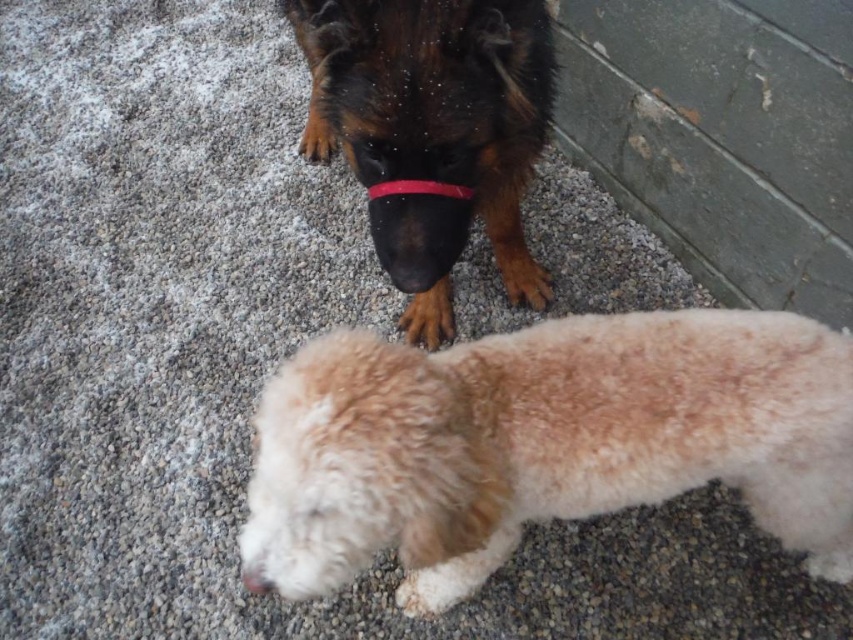
Question: From the image, what is the correct spatial relationship of white fluffy dog at lower center in relation to rubber-like red collar at center?

Choices:
 (A) above
 (B) below

Answer: (B)

Question: Does white fluffy dog at lower center come in front of brown furry dog at upper center?

Choices:
 (A) yes
 (B) no

Answer: (A)

Question: Does brown furry dog at upper center have a smaller size compared to rubber-like red collar at center?

Choices:
 (A) yes
 (B) no

Answer: (B)

Question: Which object is closer to the camera taking this photo?

Choices:
 (A) brown furry dog at upper center
 (B) rubber-like red collar at center
 (C) white fluffy dog at lower center

Answer: (C)

Question: Which object appears closest to the camera in this image?

Choices:
 (A) white fluffy nose at lower center
 (B) rubber-like red collar at center
 (C) white fluffy dog at lower center

Answer: (C)

Question: Which is nearer to the white fluffy nose at lower center?

Choices:
 (A) white fluffy dog at lower center
 (B) rubber-like red collar at center

Answer: (A)